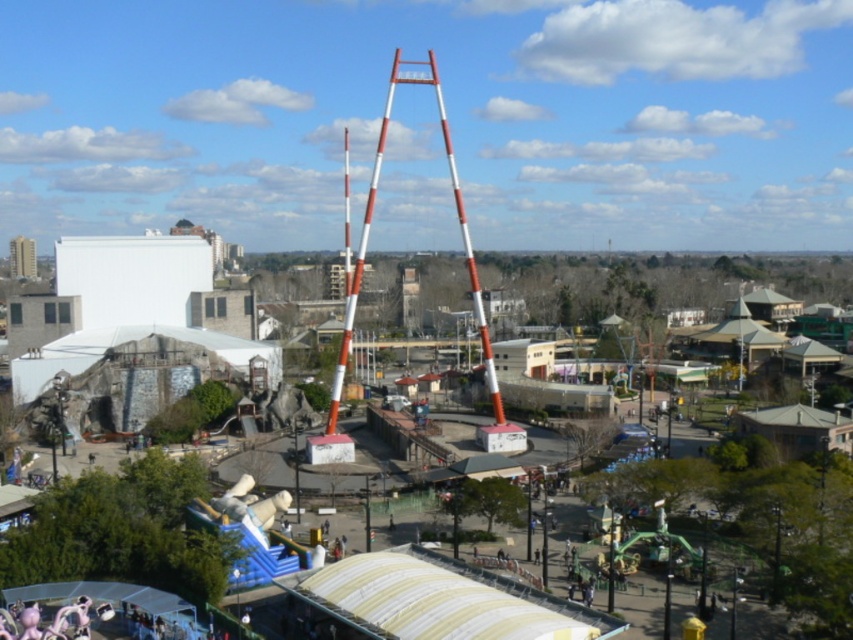
You are standing at the entrance of the amusement park and want to take a photo of both the smooth concrete amusement park at center and the orange and white striped mast at center. Which object should you position closer to the front of your camera frame to ensure both are fully visible in the photo?

To ensure both the smooth concrete amusement park at center and the orange and white striped mast at center are fully visible in the photo, you should position the smooth concrete amusement park at center closer to the front of your camera frame since it has a lesser height compared to the orange and white striped mast at center.

You are planning to place a new attraction in the amusement park. Given the sizes of the smooth concrete amusement park at center and the orange and white striped mast at center, which one would require more space to accommodate?

The smooth concrete amusement park at center is larger in size than the orange and white striped mast at center, so it would require more space to accommodate.